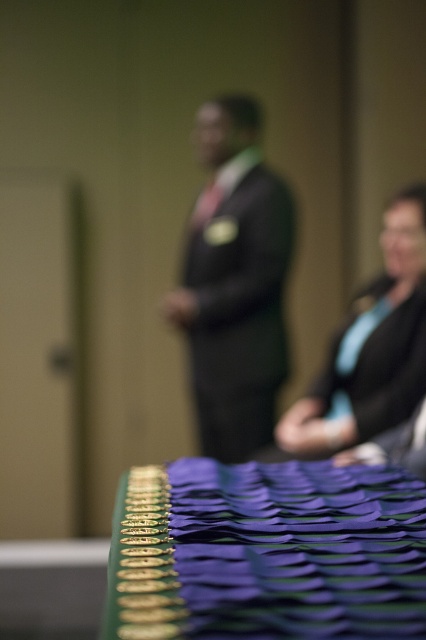
Question: Which point is closer to the camera?

Choices:
 (A) (273, 385)
 (B) (406, 248)

Answer: (B)

Question: Which point is farther to the camera?

Choices:
 (A) (143, 579)
 (B) (230, 344)

Answer: (B)

Question: Is green fabric table at lower center smaller than matte black sweater at right?

Choices:
 (A) no
 (B) yes

Answer: (B)

Question: Which object is the closest to the dark suit at center?

Choices:
 (A) matte black sweater at right
 (B) green fabric table at lower center

Answer: (A)

Question: Does dark suit at center have a smaller size compared to matte black sweater at right?

Choices:
 (A) no
 (B) yes

Answer: (A)

Question: Is green fabric table at lower center above dark suit at center?

Choices:
 (A) yes
 (B) no

Answer: (B)